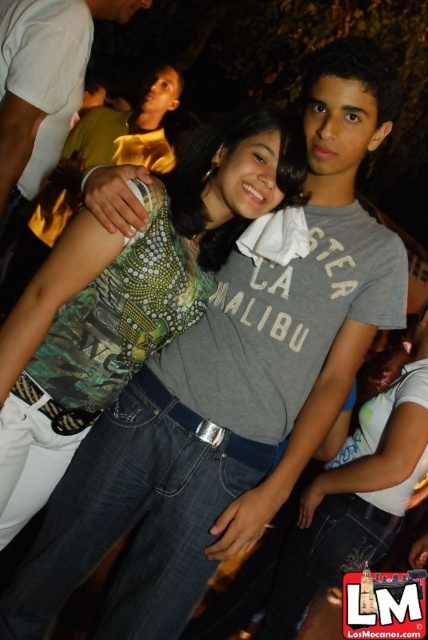
Question: Is green textured top at center smaller than matte black shirt at upper center?

Choices:
 (A) no
 (B) yes

Answer: (A)

Question: In this image, where is green textured top at center located relative to matte black shirt at upper center?

Choices:
 (A) left
 (B) right

Answer: (B)

Question: Which object is farther from the camera taking this photo?

Choices:
 (A) matte black shirt at upper center
 (B) green textured top at center

Answer: (A)

Question: Does green textured top at center have a smaller size compared to matte black shirt at upper center?

Choices:
 (A) no
 (B) yes

Answer: (A)